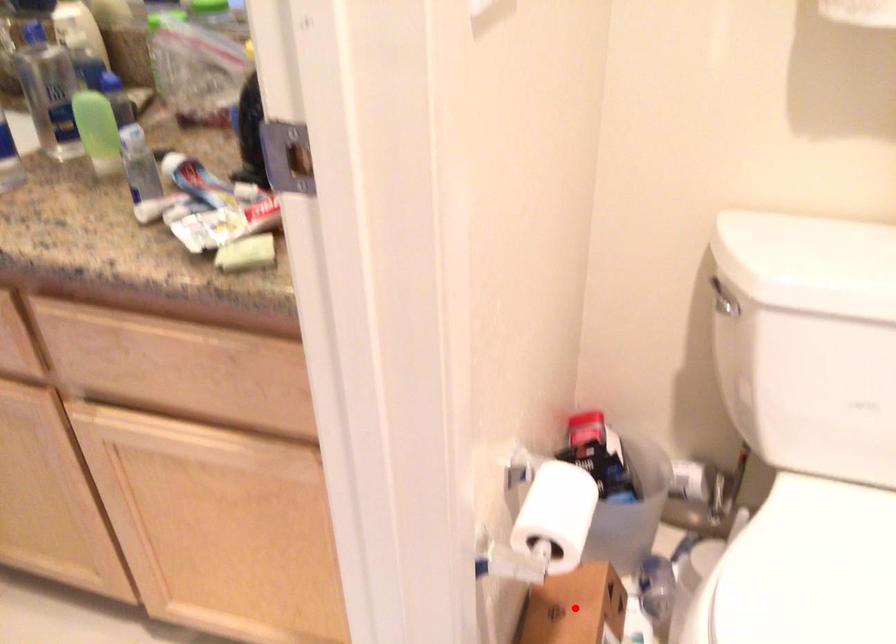
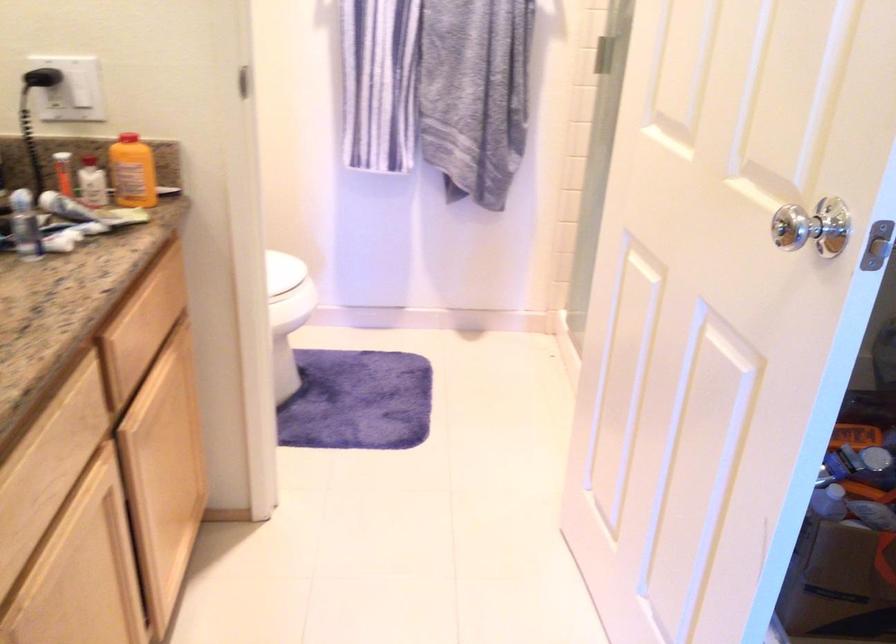
Question: I am providing you with two images of the same scene from different viewpoints. A red point is marked on the first image. Can you still see the location of the red point in image 2?

Choices:
 (A) Yes
 (B) No

Answer: (B)